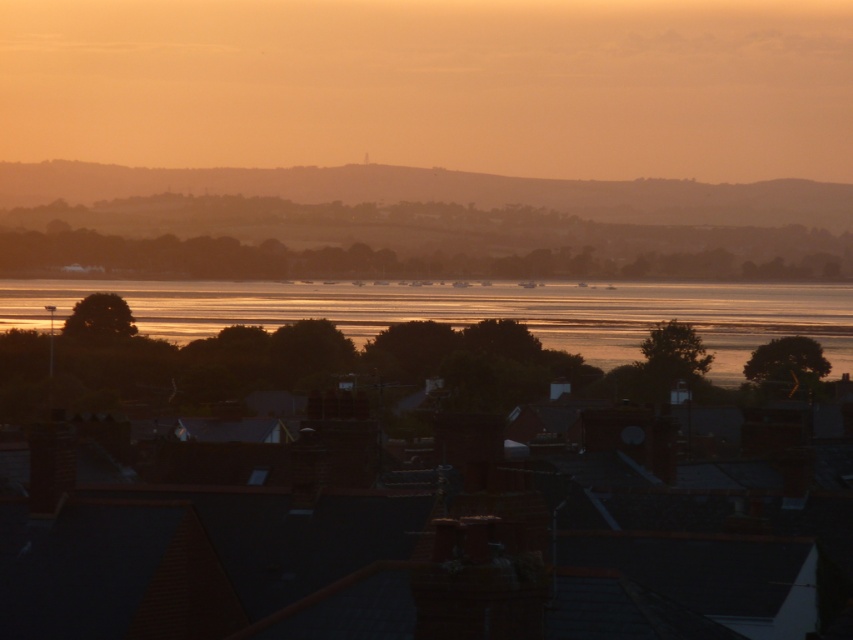
Who is positioned more to the left, silvery metallic water at center or shiny metallic water at center?

shiny metallic water at center is more to the left.

Does point (424, 264) come farther from viewer compared to point (529, 291)?

Yes, it is.

The image size is (853, 640). In order to click on silvery metallic water at center in this screenshot , I will do `click(413, 225)`.